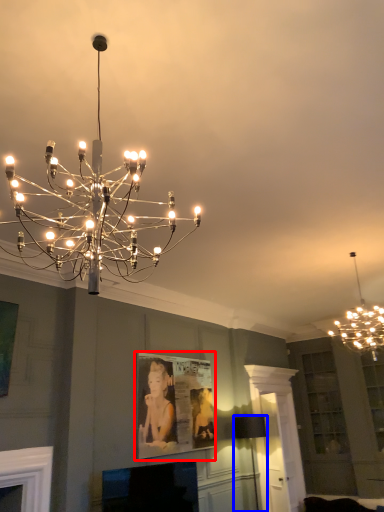
Question: Which object appears farthest to the camera in this image, picture frame (highlighted by a red box) or lamp (highlighted by a blue box)?

Choices:
 (A) picture frame
 (B) lamp

Answer: (B)